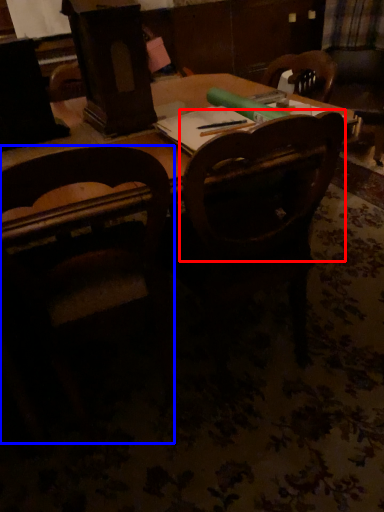
Question: Which object is closer to the camera taking this photo, chair (highlighted by a red box) or chair (highlighted by a blue box)?

Choices:
 (A) chair
 (B) chair

Answer: (B)